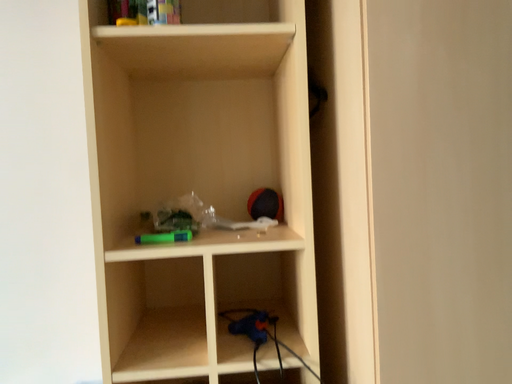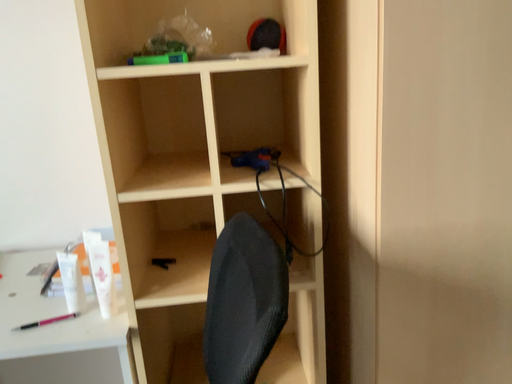
Question: How did the camera likely rotate when shooting the video?

Choices:
 (A) rotated upward
 (B) rotated downward

Answer: (B)